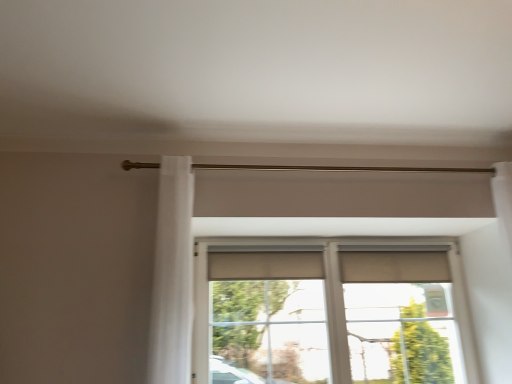
In order to face matte beige window at center, should I rotate leftwards or rightwards?

Turn right approximately 11.005 degrees to face it.

The height and width of the screenshot is (384, 512). Identify the location of matte beige window at center. (331, 312).

Image resolution: width=512 pixels, height=384 pixels. What do you see at coordinates (331, 312) in the screenshot? I see `matte beige window at center` at bounding box center [331, 312].

This screenshot has width=512, height=384. What do you see at coordinates (173, 275) in the screenshot?
I see `white sheer curtain at left` at bounding box center [173, 275].

Where is `white sheer curtain at left`? white sheer curtain at left is located at coordinates (173, 275).

Locate an element on the screen. The width and height of the screenshot is (512, 384). matte beige window at center is located at coordinates (331, 312).

Can you confirm if matte beige window at center is positioned to the right of white sheer curtain at left?

Yes.

Is matte beige window at center behind white sheer curtain at left?

Yes, it is behind white sheer curtain at left.

Which point is more forward, (473, 363) or (168, 226)?

Positioned in front is point (168, 226).

From the image's perspective, which one is positioned lower, matte beige window at center or white sheer curtain at left?

From the image's view, matte beige window at center is below.

From a real-world perspective, is matte beige window at center under white sheer curtain at left?

Yes, from a real-world perspective, matte beige window at center is beneath white sheer curtain at left.

Considering the relative sizes of matte beige window at center and white sheer curtain at left in the image provided, is matte beige window at center thinner than white sheer curtain at left?

Correct, the width of matte beige window at center is less than that of white sheer curtain at left.

Considering the sizes of objects matte beige window at center and white sheer curtain at left in the image provided, who is taller, matte beige window at center or white sheer curtain at left?

white sheer curtain at left is taller.

Between matte beige window at center and white sheer curtain at left, which one has larger size?

With larger size is matte beige window at center.

Is matte beige window at center not within white sheer curtain at left?

matte beige window at center is positioned outside white sheer curtain at left.

Is matte beige window at center beside white sheer curtain at left?

No.

Is matte beige window at center facing towards white sheer curtain at left?

Yes, matte beige window at center faces towards white sheer curtain at left.

What's the angular difference between matte beige window at center and white sheer curtain at left's facing directions?

They differ by 0.00139 degrees in their facing directions.

At what (x,y) coordinates should I click in order to perform the action: click on window below the white sheer curtain at left (from a real-world perspective). Please return your answer as a coordinate pair (x, y). Image resolution: width=512 pixels, height=384 pixels. Looking at the image, I should click on (331, 312).

Is white sheer curtain at left to the left of matte beige window at center from the viewer's perspective?

Indeed, white sheer curtain at left is positioned on the left side of matte beige window at center.

Does white sheer curtain at left lie behind matte beige window at center?

No.

Is point (179, 157) positioned in front of point (437, 249)?

Yes, point (179, 157) is in front of point (437, 249).

From the image's perspective, does white sheer curtain at left appear higher than matte beige window at center?

Yes.

From a real-world perspective, is white sheer curtain at left physically above matte beige window at center?

Yes.

Does white sheer curtain at left have a greater width compared to matte beige window at center?

Indeed, white sheer curtain at left has a greater width compared to matte beige window at center.

Considering the sizes of white sheer curtain at left and matte beige window at center in the image, is white sheer curtain at left taller or shorter than matte beige window at center?

Clearly, white sheer curtain at left is taller compared to matte beige window at center.

Considering the sizes of white sheer curtain at left and matte beige window at center in the image, is white sheer curtain at left bigger or smaller than matte beige window at center?

Considering their sizes, white sheer curtain at left takes up less space than matte beige window at center.

Do you think white sheer curtain at left is within matte beige window at center, or outside of it?

white sheer curtain at left is not enclosed by matte beige window at center.

Does white sheer curtain at left touch matte beige window at center?

There is a gap between white sheer curtain at left and matte beige window at center.

Could you tell me if white sheer curtain at left is facing matte beige window at center?

No, white sheer curtain at left is not oriented towards matte beige window at center.

Can you tell me how much white sheer curtain at left and matte beige window at center differ in facing direction?

They differ by 0.00139 degrees in their facing directions.

Where is `window below the white sheer curtain at left (from a real-world perspective)`? window below the white sheer curtain at left (from a real-world perspective) is located at coordinates (331, 312).

This screenshot has width=512, height=384. What are the coordinates of `shower curtain above the matte beige window at center (from the image's perspective)` in the screenshot? It's located at (173, 275).

Locate an element on the screen. Image resolution: width=512 pixels, height=384 pixels. window behind the white sheer curtain at left is located at coordinates (331, 312).